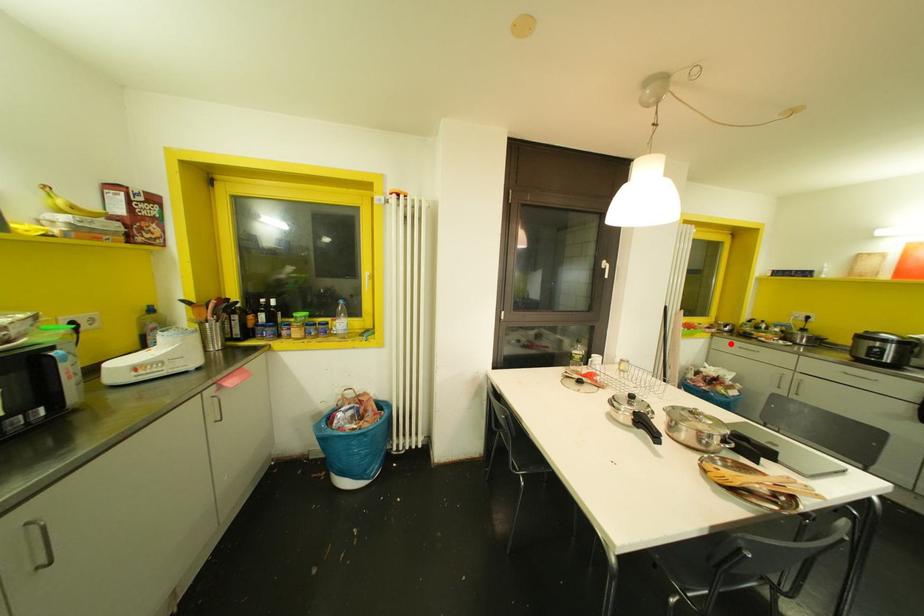
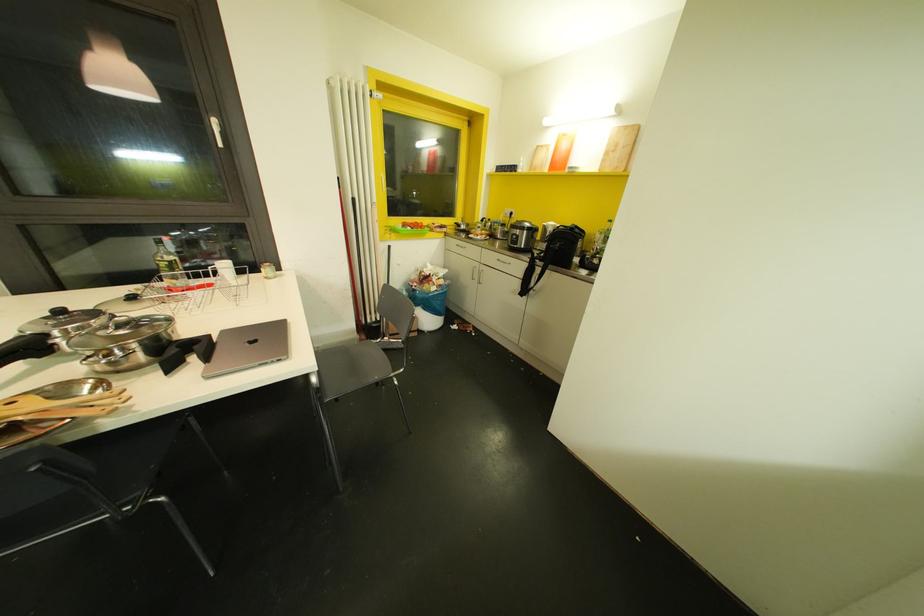
Question: I am providing you with two images of the same scene from different viewpoints. A red point is shown in image1. For the corresponding object point in image2, is it positioned nearer or farther from the camera?

Choices:
 (A) Nearer
 (B) Farther

Answer: (B)